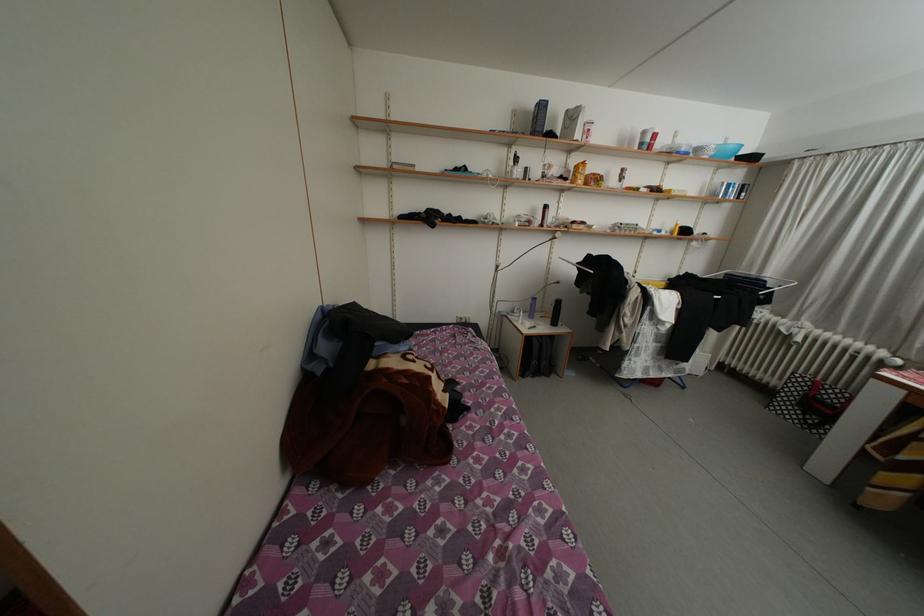
Where would you lift the white egg carton? Please return your answer as a coordinate pair (x, y).

(572, 122)